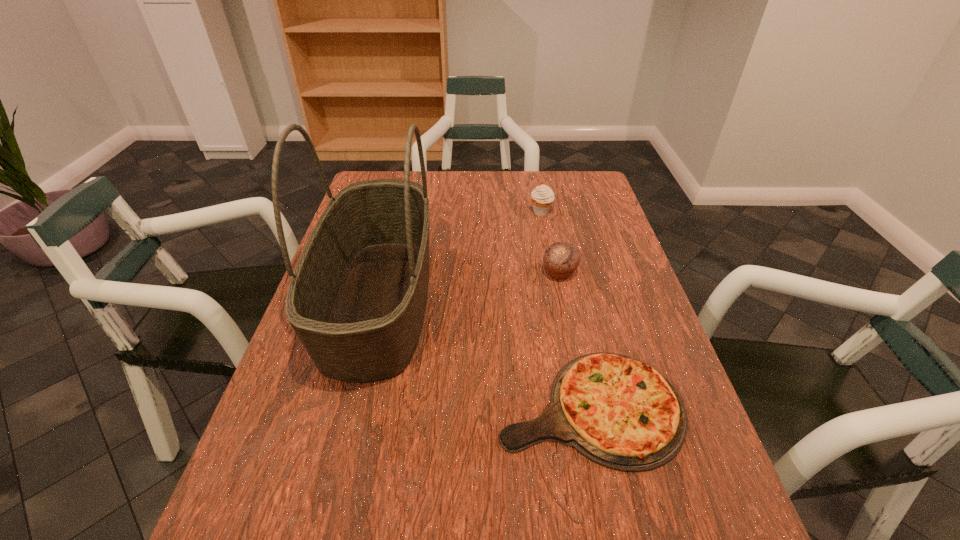
Locate an element on the screen. basket is located at coordinates (357, 298).

Locate an element on the screen. The width and height of the screenshot is (960, 540). the tallest object is located at coordinates (357, 298).

Where is `the farthest object`? The image size is (960, 540). the farthest object is located at coordinates (542, 196).

You are a GUI agent. You are given a task and a screenshot of the screen. Output one action in this format:
    pyautogui.click(x=<x>, y=<y>)
    Task: Click on the third tallest object
    This screenshot has width=960, height=540.
    Given the screenshot: What is the action you would take?
    pyautogui.click(x=561, y=259)

Image resolution: width=960 pixels, height=540 pixels. Identify the location of the shorter muffin. (561, 259).

I want to click on pizza, so click(x=615, y=410).

Where is `free space located on the front of the tallest object`? free space located on the front of the tallest object is located at coordinates (338, 470).

Identify the location of vacant region located on the left of the farther muffin. The width and height of the screenshot is (960, 540). (442, 212).

You are a GUI agent. You are given a task and a screenshot of the screen. Output one action in this format:
    pyautogui.click(x=<x>, y=<y>)
    Task: Click on the vacant space located 0.280m on the left of the nearer muffin
    This screenshot has height=540, width=960.
    Given the screenshot: What is the action you would take?
    pyautogui.click(x=437, y=273)

Where is `vacant space located 0.290m on the back of the pizza`? The image size is (960, 540). vacant space located 0.290m on the back of the pizza is located at coordinates (561, 270).